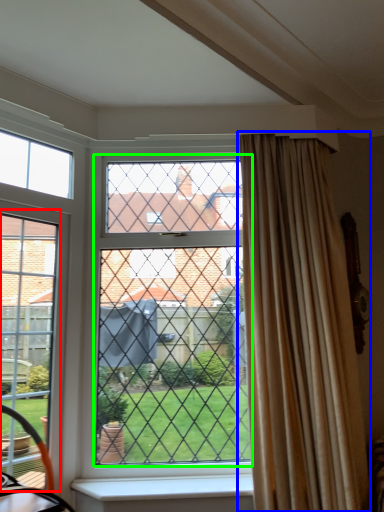
Question: Estimate the real-world distances between objects in this image. Which object is farther from screen door (highlighted by a red box), curtain (highlighted by a blue box) or glass window (highlighted by a green box)?

Choices:
 (A) curtain
 (B) glass window

Answer: (A)